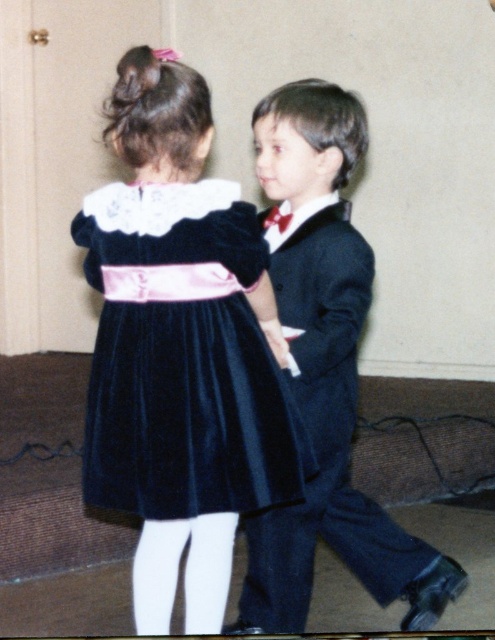
You are a photographer trying to capture the perfect shot of the children. You notice a specific point in the image at coordinates (183, 358). Which child is closer to this point?

The point at (183, 358) marks the velvet dark blue dress at center, which belongs to the girl on the left. Therefore, the girl is closer to this point.

You are a photographer trying to capture a group photo of the velvet dark blue dress at center and the velvet suit at center. Since you want both outfits to be clearly visible, which one should you focus on first to ensure proper framing?

The velvet dark blue dress at center is narrower than the velvet suit at center, so you should focus on the velvet suit at center first to accommodate its wider frame.